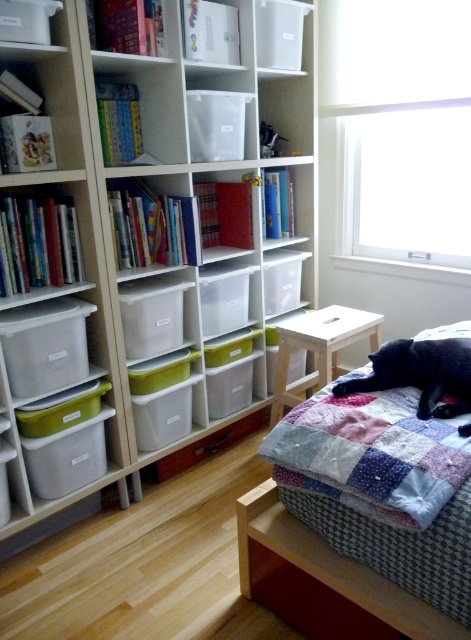
Question: Which point is farther to the camera?

Choices:
 (A) light wood stool at center
 (B) patchwork quilt at upper right
 (C) white plastic bookcase at upper left

Answer: (A)

Question: Can you confirm if patchwork quilt at upper right is bigger than matte plastic drawer at lower center?

Choices:
 (A) no
 (B) yes

Answer: (B)

Question: Which point appears farthest from the camera in this image?

Choices:
 (A) (305, 438)
 (B) (422, 392)
 (C) (188, 456)
 (D) (295, 346)

Answer: (C)

Question: Is patchwork quilt at center further to camera compared to matte plastic drawer at lower center?

Choices:
 (A) yes
 (B) no

Answer: (B)

Question: Considering the real-world distances, which object is farthest from the patchwork quilt at upper right?

Choices:
 (A) matte plastic drawer at lower center
 (B) black fur cat at lower right

Answer: (A)

Question: In this image, where is white plastic bookcase at upper left located relative to matte plastic drawer at lower center?

Choices:
 (A) above
 (B) below

Answer: (A)